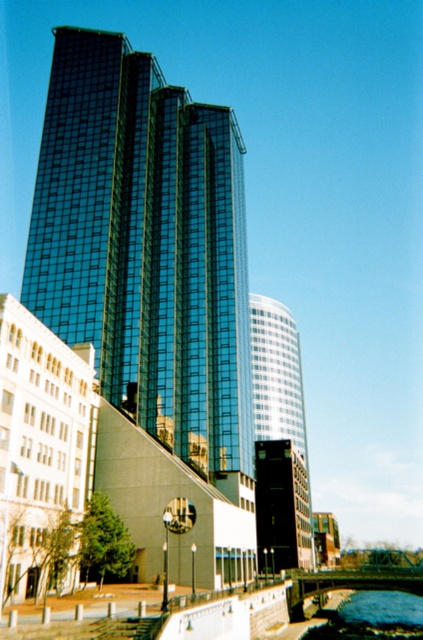
Who is lower down, glassy reflective skyscraper at center or blue glassy water at lower center?

blue glassy water at lower center

Does glassy reflective skyscraper at center appear on the right side of blue glassy water at lower center?

Incorrect, glassy reflective skyscraper at center is not on the right side of blue glassy water at lower center.

Is point (238, 204) farther from camera compared to point (395, 611)?

No, it is in front of (395, 611).

Locate an element on the screen. glassy reflective skyscraper at center is located at coordinates [147, 250].